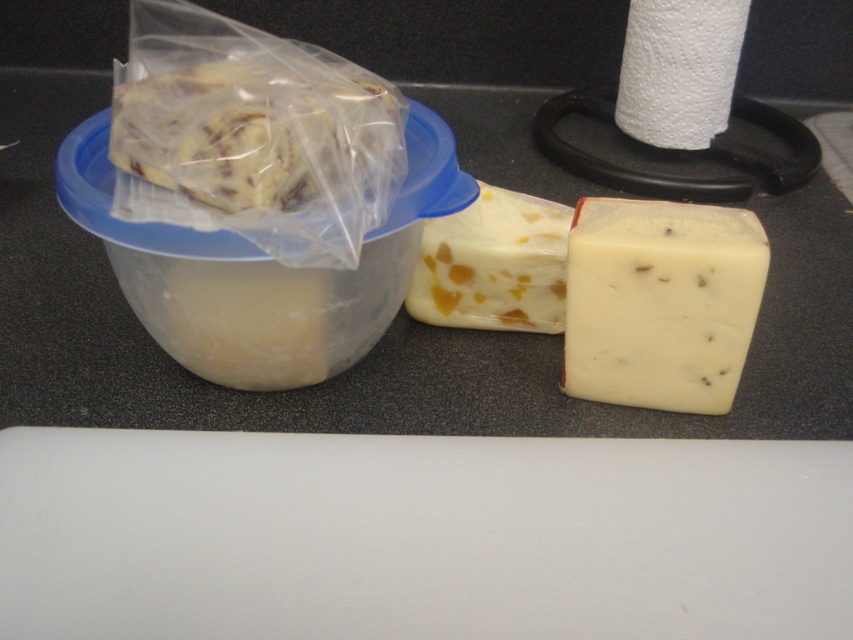
Question: Which point is farther to the camera?

Choices:
 (A) (447, 230)
 (B) (236, 81)
 (C) (625, 275)
 (D) (734, 72)

Answer: (D)

Question: Is white creamy cheese at center bigger than white textured paper towel at upper right?

Choices:
 (A) yes
 (B) no

Answer: (B)

Question: Considering the real-world distances, which object is farthest from the translucent plastic bagged food at left?

Choices:
 (A) yellow crumbly cheese at center
 (B) white creamy cheese at center
 (C) white textured paper towel at upper right

Answer: (C)

Question: Does yellow crumbly cheese at center appear under white textured paper towel at upper right?

Choices:
 (A) yes
 (B) no

Answer: (A)

Question: From the image, what is the correct spatial relationship of translucent plastic bagged food at left in relation to white textured paper towel at upper right?

Choices:
 (A) below
 (B) above

Answer: (A)

Question: Which of these objects is positioned closest to the white textured paper towel at upper right?

Choices:
 (A) translucent plastic bagged food at left
 (B) white creamy cheese at center
 (C) yellow crumbly cheese at center

Answer: (C)